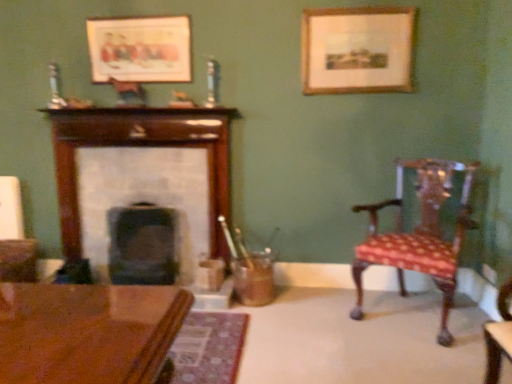
Question: Is polished wood chair at right inside or outside of wooden fireplace at center, placed as the 1th fireplace when sorted from left to right?

Choices:
 (A) outside
 (B) inside

Answer: (A)

Question: Does point (417, 230) appear closer or farther from the camera than point (209, 160)?

Choices:
 (A) closer
 (B) farther

Answer: (A)

Question: Estimate the real-world distances between objects in this image. Which object is farther from the smooth dark wood fireplace at center, the first fireplace in the right-to-left sequence?

Choices:
 (A) wooden picture frame at upper center, placed as the second picture frame when sorted from right to left
 (B) polished wood chair at right
 (C) wooden picture frame at upper right, which ranks as the 1th picture frame in right-to-left order
 (D) wooden fireplace at center, placed as the 1th fireplace when sorted from left to right

Answer: (C)

Question: Which object is positioned closest to the wooden picture frame at upper right, the 2th picture frame when ordered from left to right?

Choices:
 (A) polished wood chair at right
 (B) smooth dark wood fireplace at center, the second fireplace from the left
 (C) wooden fireplace at center, which is counted as the 2th fireplace, starting from the right
 (D) wooden picture frame at upper center, placed as the second picture frame when sorted from right to left

Answer: (A)